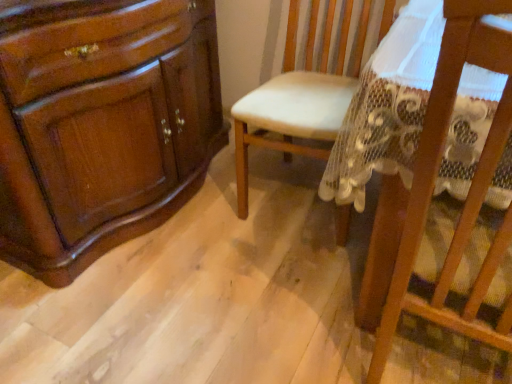
Locate an element on the screen. This screenshot has width=512, height=384. free location to the left of white leather chair at center, which is counted as the second chair, starting from the front is located at coordinates point(204,213).